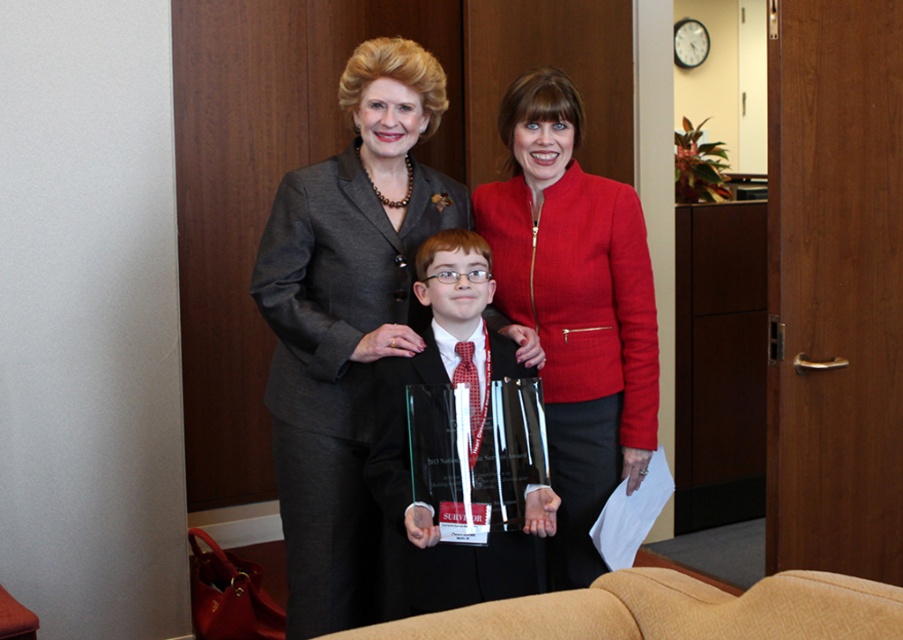
You are organizing a charity event and need to decide which item to place on the podium. The podium has a space that can only accommodate items smaller than the other. Given the items available are the matte gray business suit at center and the clear glass award at center, which item should you choose?

The clear glass award at center should be chosen because it is smaller in size than the matte gray business suit at center, making it suitable for the podium space.

You are organizing a photo shoot and need to arrange two outfits on a mannequin stand. The stand has a limited width capacity. Given the scene description, which outfit from the matte gray business suit at center and the matte red blazer at center would you choose to fit on the stand if the stand can only accommodate the narrower of the two?

The matte red blazer at center is narrower than the matte gray business suit at center, so you should choose the matte red blazer at center to fit on the stand.

You are a photographer setting up a camera at the back of the room. You need to ensure that both the matte gray business suit at center and the matte red blazer at center are fully visible in the frame. Given that the camera can only capture objects up to 1.5 meters tall, will both individuals be fully visible?

The matte gray business suit at center is not as tall as the matte red blazer at center. Since the camera can only capture up to 1.5 meters, if the taller individual, the matte red blazer at center, is under 1.5 meters, both will be visible. However, if the matte red blazer at center exceeds 1.5 meters, only the shorter matte gray business suit at center will be fully visible.